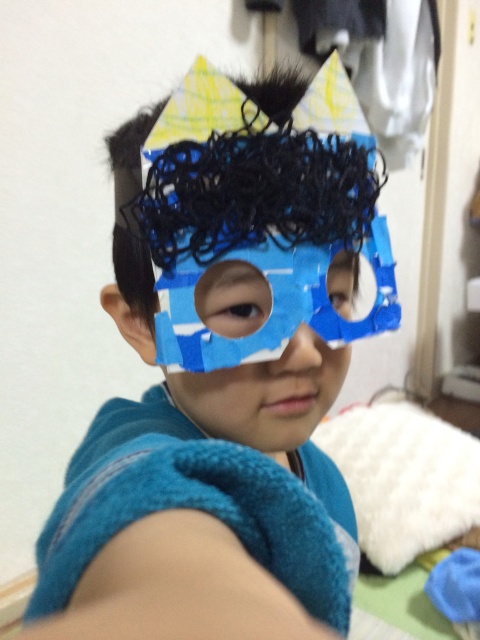
Based on the photo, you are a photographer trying to capture the perfect shot of the child in the blue cardboard mask at center. To ensure the mask is centered in the frame, where should you position your camera? Use the coordinates provided in the scene description to guide your answer.

The blue cardboard mask at center is located at coordinates (219,385). To center it in the frame, position the camera so the mask aligns with the center point of the image, which is typically at coordinates (240,320). Adjust the camera slightly to the right and up to move the mask closer to the center.

The child in the image is wearing a costume with two eyes. The blue matte eye at center and the brown matte eye at center. Which eye is positioned higher on the mask?

The blue matte eye at center is positioned higher than the brown matte eye at center according to the description.